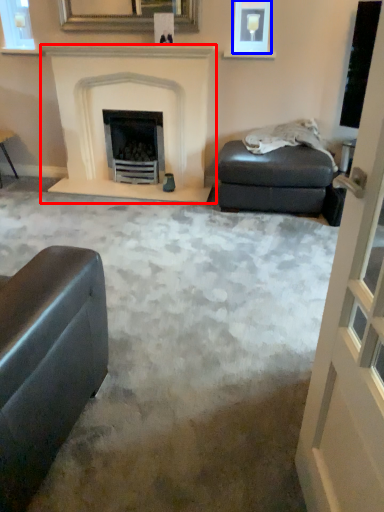
Question: Which object is closer to the camera taking this photo, fireplace (highlighted by a red box) or picture frame (highlighted by a blue box)?

Choices:
 (A) fireplace
 (B) picture frame

Answer: (A)